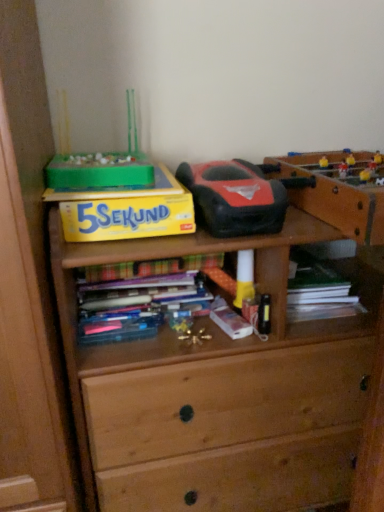
Question: From a real-world perspective, is hardcover book at center physically above yellow matte paper at upper left?

Choices:
 (A) no
 (B) yes

Answer: (A)

Question: Does hardcover book at center have a lesser height compared to yellow matte paper at upper left?

Choices:
 (A) yes
 (B) no

Answer: (A)

Question: Is hardcover book at center at the left side of yellow matte paper at upper left?

Choices:
 (A) no
 (B) yes

Answer: (A)

Question: Would you say hardcover book at center is a long distance from yellow matte paper at upper left?

Choices:
 (A) yes
 (B) no

Answer: (B)

Question: Is hardcover book at center facing towards yellow matte paper at upper left?

Choices:
 (A) yes
 (B) no

Answer: (B)

Question: From a real-world perspective, does hardcover book at center sit lower than yellow matte paper at upper left?

Choices:
 (A) yes
 (B) no

Answer: (A)

Question: From the image's perspective, is yellow matte paper at upper left over hardcover book at center?

Choices:
 (A) no
 (B) yes

Answer: (B)

Question: Is yellow matte paper at upper left bigger than hardcover book at center?

Choices:
 (A) yes
 (B) no

Answer: (A)

Question: Is yellow matte paper at upper left at the right side of hardcover book at center?

Choices:
 (A) yes
 (B) no

Answer: (B)

Question: Does yellow matte paper at upper left come in front of hardcover book at center?

Choices:
 (A) yes
 (B) no

Answer: (A)

Question: From the image's perspective, does yellow matte paper at upper left appear lower than hardcover book at center?

Choices:
 (A) yes
 (B) no

Answer: (B)

Question: Are yellow matte paper at upper left and hardcover book at center far apart?

Choices:
 (A) yes
 (B) no

Answer: (B)

Question: From the image's perspective, is metallic gold toy at center, the 2th toy positioned from the top, over rubberized black and red toy car at center, which is the 2th toy in bottom-to-top order?

Choices:
 (A) no
 (B) yes

Answer: (A)